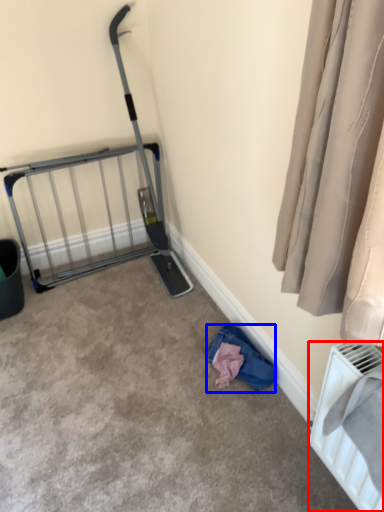
Question: Which object appears closest to the camera in this image, radiator (highlighted by a red box) or clothing (highlighted by a blue box)?

Choices:
 (A) radiator
 (B) clothing

Answer: (A)